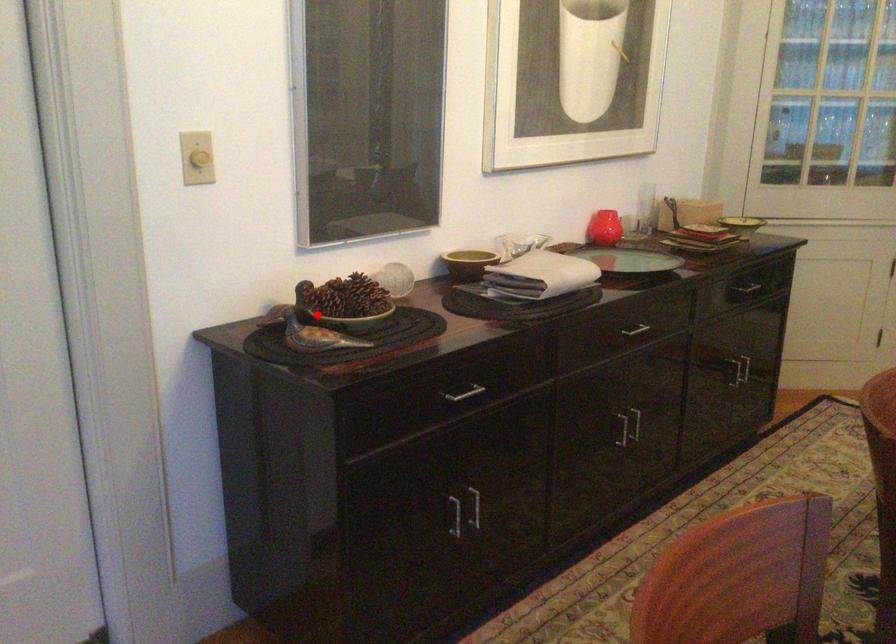
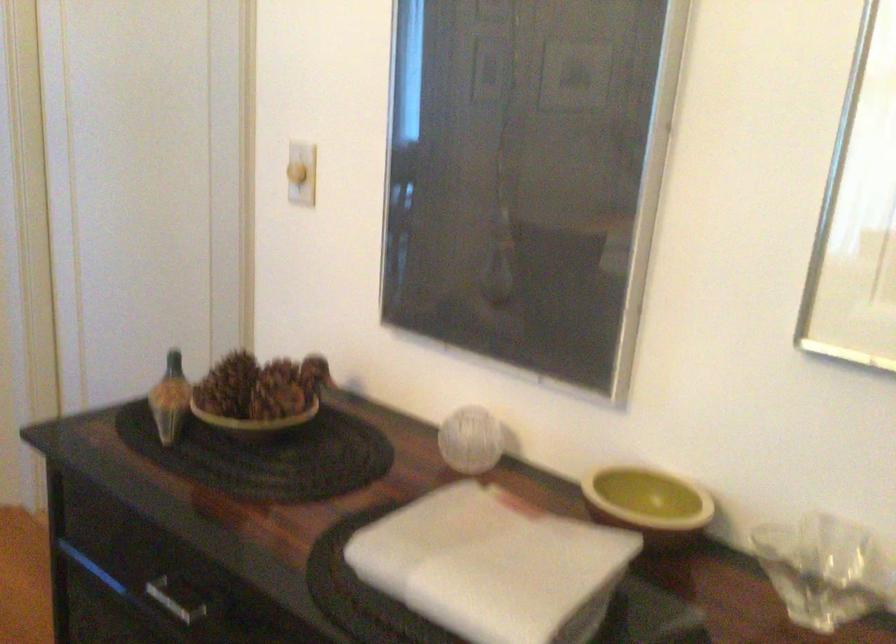
Question: I am providing you with two images of the same scene from different viewpoints. Image1 has a red point marked. In image2, the corresponding 3D location appears at what relative position? Reply with the corresponding letter.

Choices:
 (A) Closer
 (B) Farther

Answer: (A)